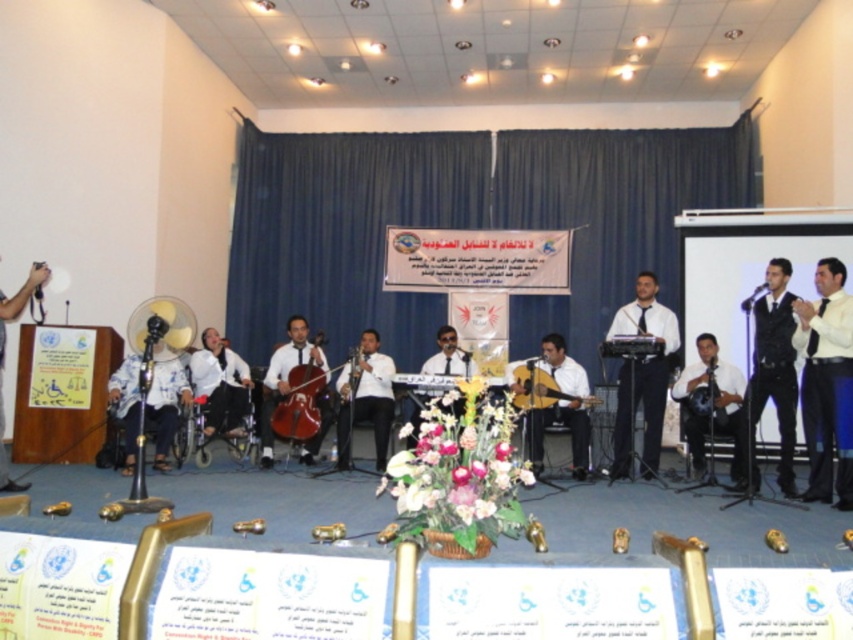
Is point (30, 282) behind point (589, 401)?

No, it is not.

Which of these two, matte black camera at left or wooden acoustic guitar at center, stands shorter?

wooden acoustic guitar at center is shorter.

Is point (27, 284) positioned before point (520, 394)?

Yes, point (27, 284) is in front of point (520, 394).

Locate an element on the screen. matte black camera at left is located at coordinates (3, 355).

Between white glossy keyboard at center and wooden acoustic guitar at center, which one is positioned lower?

wooden acoustic guitar at center

Does white glossy keyboard at center appear on the right side of wooden acoustic guitar at center?

Indeed, white glossy keyboard at center is positioned on the right side of wooden acoustic guitar at center.

Who is more forward, (664, 316) or (534, 394)?

Point (534, 394) is more forward.

This screenshot has height=640, width=853. Identify the location of white glossy keyboard at center. (642, 376).

Is matte black guitar at center positioned behind matte white shirt at center?

No, matte black guitar at center is closer to the viewer.

You are a GUI agent. You are given a task and a screenshot of the screen. Output one action in this format:
    pyautogui.click(x=<x>, y=<y>)
    Task: Click on the matte black guitar at center
    This screenshot has width=853, height=640.
    Given the screenshot: What is the action you would take?
    pyautogui.click(x=561, y=406)

Locate an element on the screen. The width and height of the screenshot is (853, 640). matte black guitar at center is located at coordinates (561, 406).